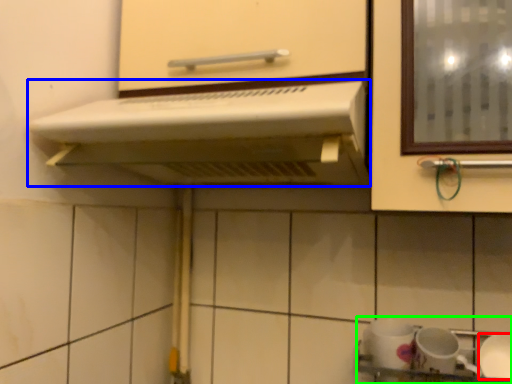
Question: Based on their relative distances, which object is nearer to tableware (highlighted by a red box)? Choose from home appliance (highlighted by a blue box) and sink (highlighted by a green box).

Choices:
 (A) home appliance
 (B) sink

Answer: (B)